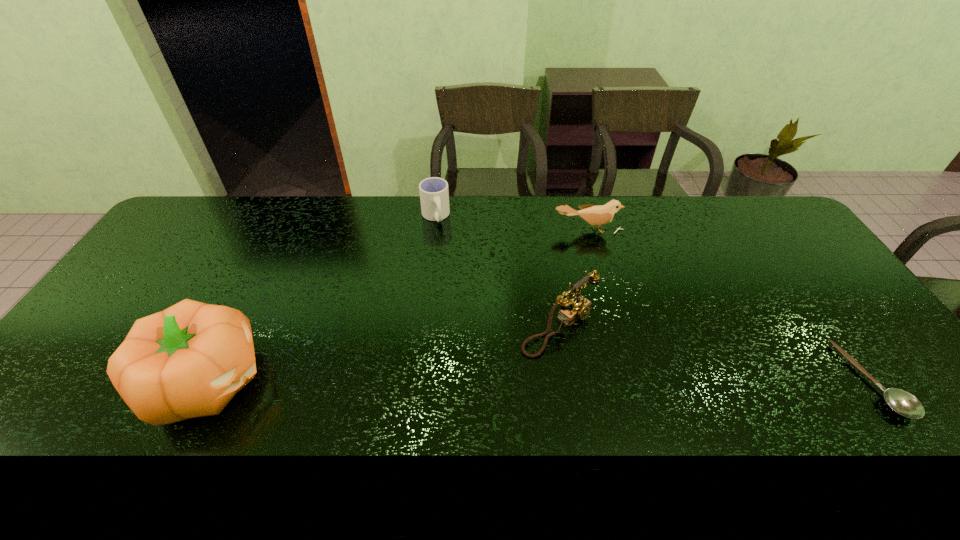
Locate an element on the screen. The width and height of the screenshot is (960, 540). free spot on the desktop that is between the tallest object and the shortest object and is positioned with the handle on the side of the second object from left to right is located at coordinates (475, 381).

What are the coordinates of `free space on the desktop that is between the pumpkin and the ladle and is positioned on the front-facing side of the telephone` in the screenshot? It's located at (630, 380).

The width and height of the screenshot is (960, 540). What are the coordinates of `vacant space on the desktop that is between the pumpkin and the shortest object and is positioned at the beak of the bird` in the screenshot? It's located at (623, 380).